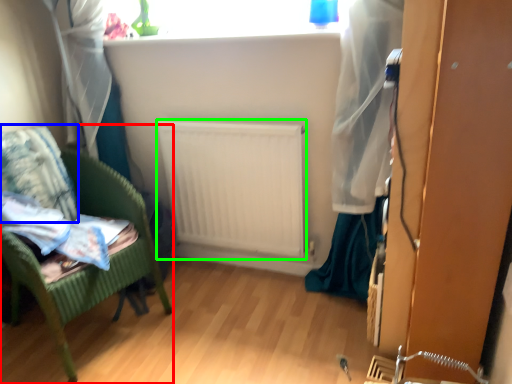
Question: Which is nearer to the furniture (highlighted by a red box)? pillow (highlighted by a blue box) or radiator (highlighted by a green box).

Choices:
 (A) pillow
 (B) radiator

Answer: (A)